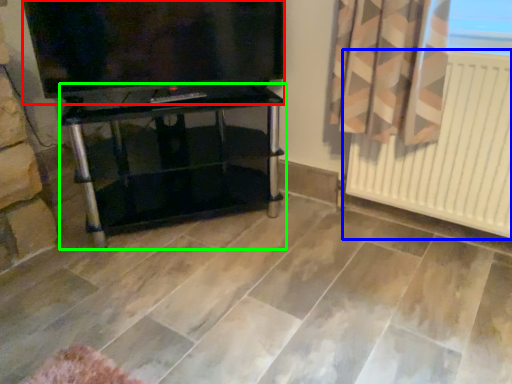
Question: Which object is positioned closest to television (highlighted by a red box)? Select from radiator (highlighted by a blue box) and furniture (highlighted by a green box).

Choices:
 (A) radiator
 (B) furniture

Answer: (B)